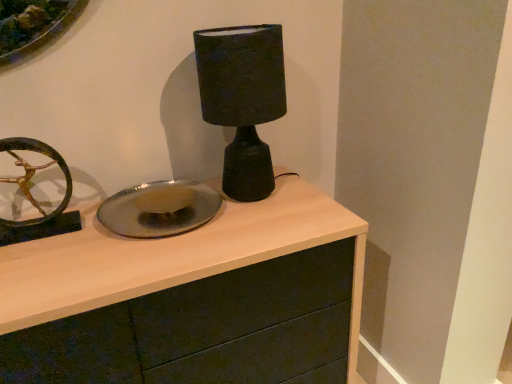
Where is `blank space situated above matte wood chest of drawers at center (from a real-world perspective)`? The height and width of the screenshot is (384, 512). blank space situated above matte wood chest of drawers at center (from a real-world perspective) is located at coordinates (124, 243).